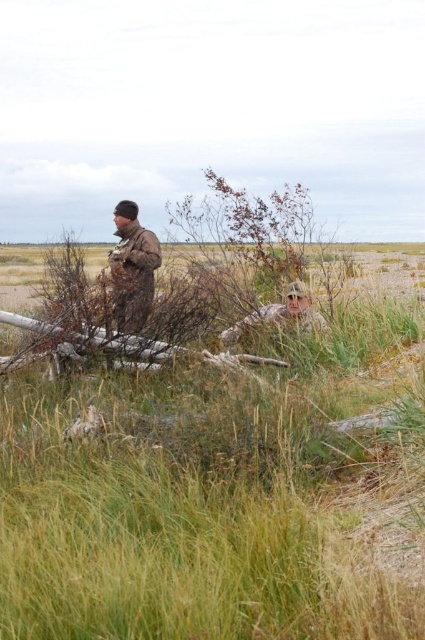
Does green grassy at center have a lesser height compared to camouflage fabric at center?

No.

Does point (221, 582) come farther from viewer compared to point (280, 316)?

No, (221, 582) is in front of (280, 316).

What do you see at coordinates (181, 513) in the screenshot? I see `green grassy at center` at bounding box center [181, 513].

Where is `green grassy at center`? green grassy at center is located at coordinates (181, 513).

Is point (150, 275) positioned before point (286, 326)?

No, (150, 275) is behind (286, 326).

Does point (119, 202) come behind point (220, 336)?

Yes.

This screenshot has width=425, height=640. I want to click on camouflage jacket at left, so click(133, 268).

Measure the distance from green grassy at center to camouflage jacket at left.

They are 2.19 meters apart.

Can you confirm if green grassy at center is bigger than camouflage jacket at left?

Yes.

Find the location of a particular element. green grassy at center is located at coordinates (181, 513).

Where is `green grassy at center`? The height and width of the screenshot is (640, 425). green grassy at center is located at coordinates (181, 513).